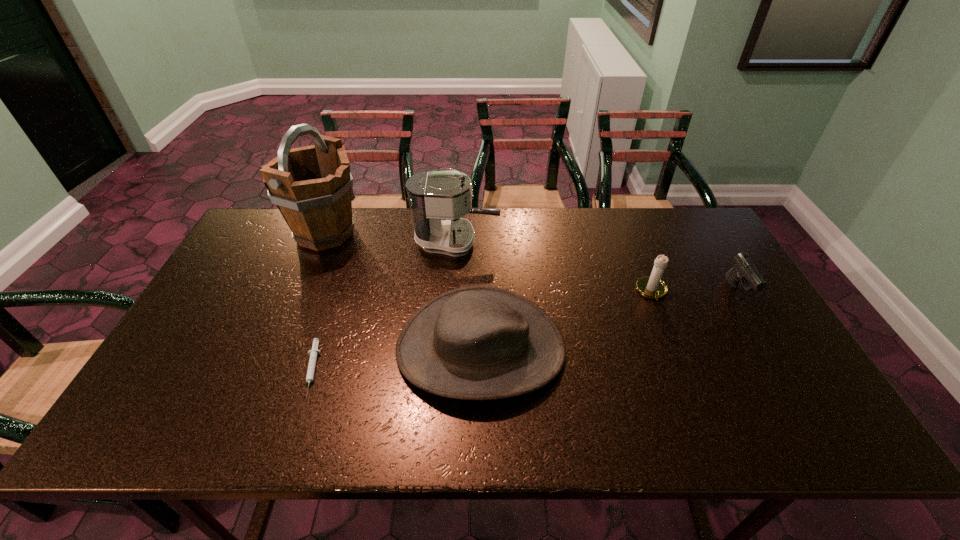
Find the location of `vacant area between the bucket and the fifth object from left to right`. vacant area between the bucket and the fifth object from left to right is located at coordinates (489, 262).

The image size is (960, 540). What are the coordinates of `free spot between the cowboy hat and the second object from right to left` in the screenshot? It's located at (566, 320).

Locate an element on the screen. This screenshot has height=540, width=960. free space between the coffee maker and the rightmost object is located at coordinates (597, 267).

Identify the location of unoccupied position between the cowboy hat and the shortest object. (396, 359).

Locate which object is the third closest to the second shortest object. Please provide its 2D coordinates. Your answer should be formatted as a tuple, i.e. [(x, y)], where the tuple contains the x and y coordinates of a point satisfying the conditions above.

[(438, 199)]

In order to click on the closest object to the second shortest object in this screenshot , I will do `click(652, 286)`.

Locate an element on the screen. vacant point that satisfies the following two spatial constraints: 1. on the back side of the cowboy hat; 2. on the left side of the shortest object is located at coordinates (319, 348).